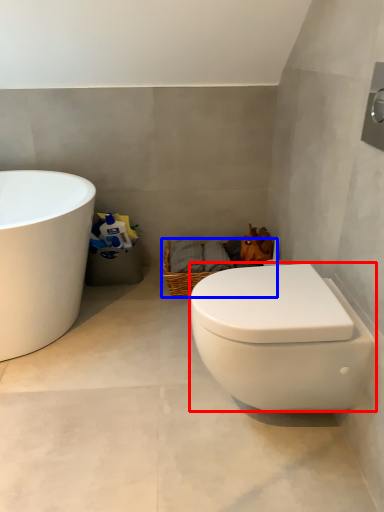
Question: Which of the following is the farthest to the observer, toilet (highlighted by a red box) or basket (highlighted by a blue box)?

Choices:
 (A) toilet
 (B) basket

Answer: (B)